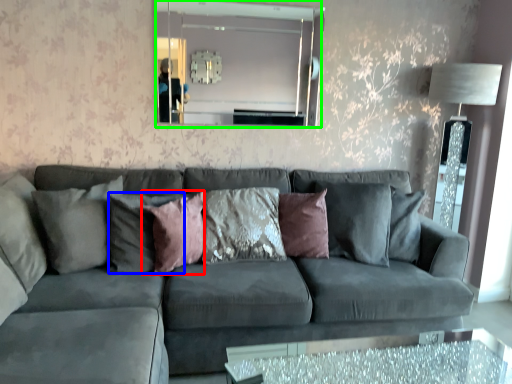
Question: Which is nearer to the pillow (highlighted by a red box)? pillow (highlighted by a blue box) or mirror (highlighted by a green box).

Choices:
 (A) pillow
 (B) mirror

Answer: (A)